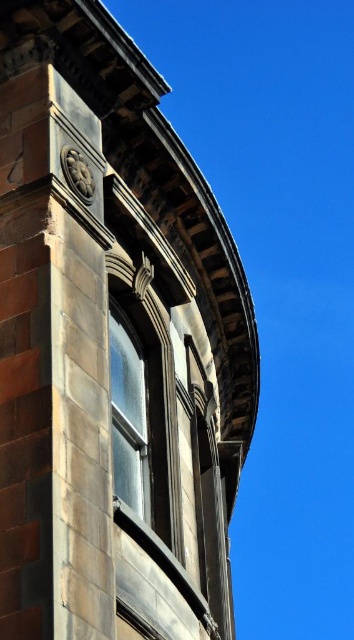
Does point (151, 260) come farther from viewer compared to point (120, 372)?

Yes, it is.

You are a GUI agent. You are given a task and a screenshot of the screen. Output one action in this format:
    pyautogui.click(x=<x>, y=<y>)
    Task: Click on the dark gray stone window at center
    The height and width of the screenshot is (640, 354).
    Given the screenshot: What is the action you would take?
    pyautogui.click(x=111, y=346)

The height and width of the screenshot is (640, 354). In order to click on dark gray stone window at center in this screenshot , I will do `click(111, 346)`.